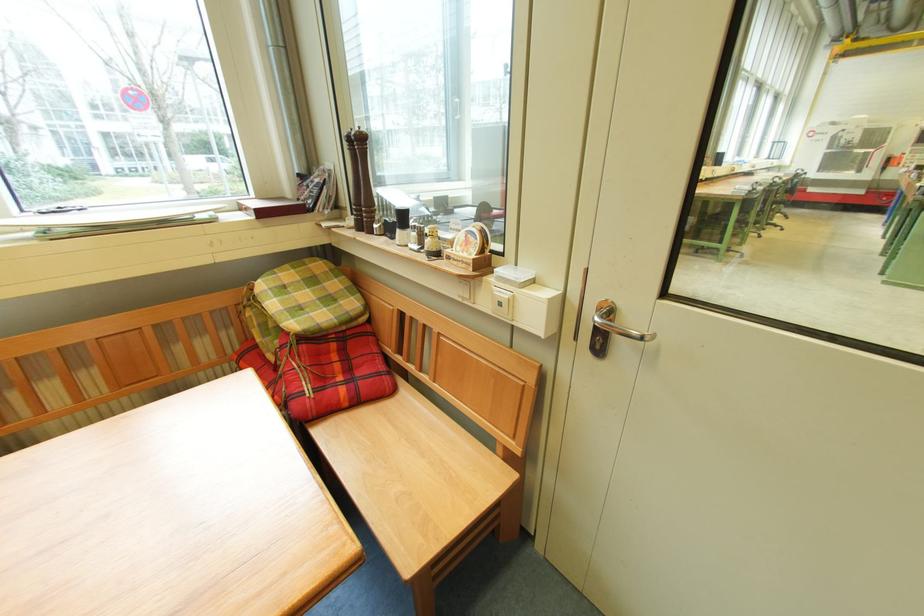
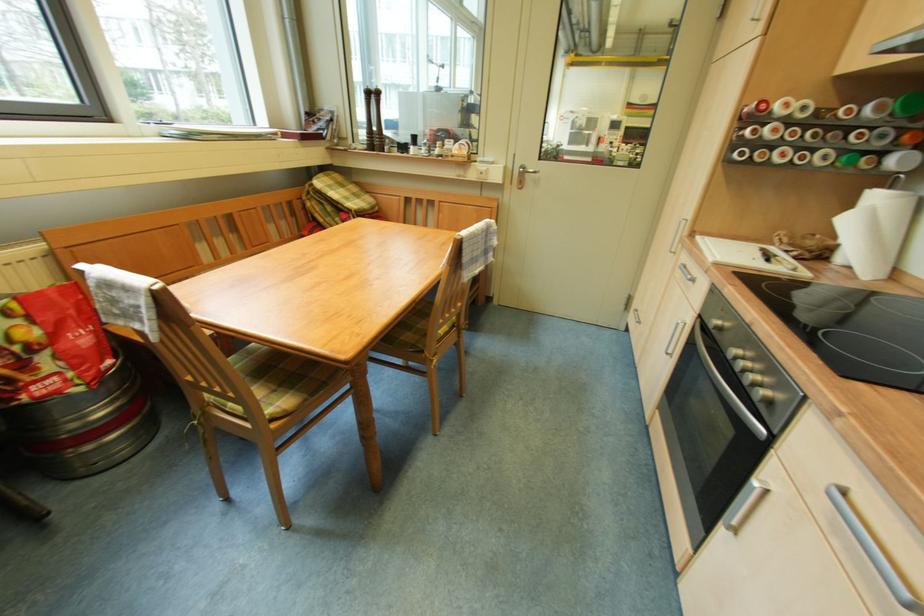
In a continuous first-person perspective shot, in which direction is the camera moving?

The cameraman moved toward left, backward.